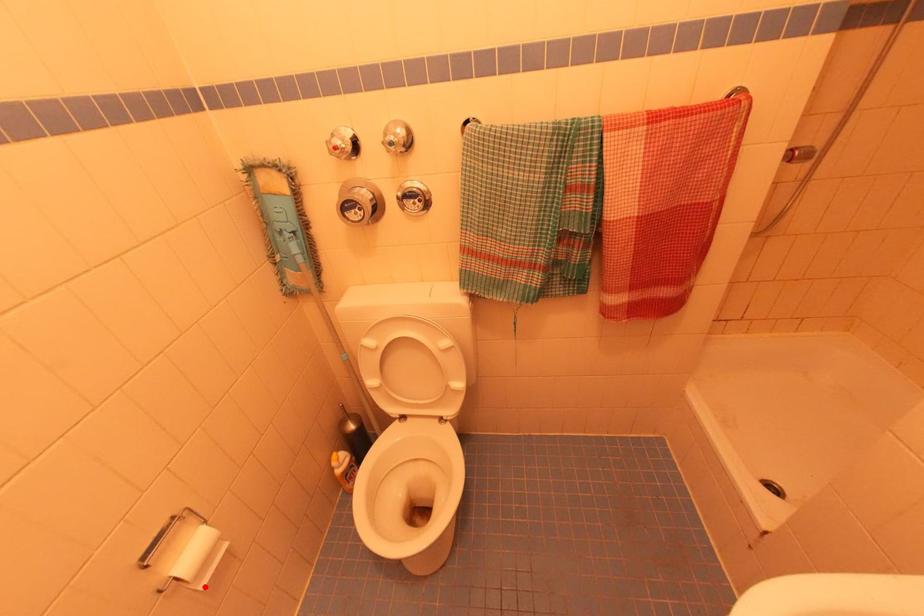
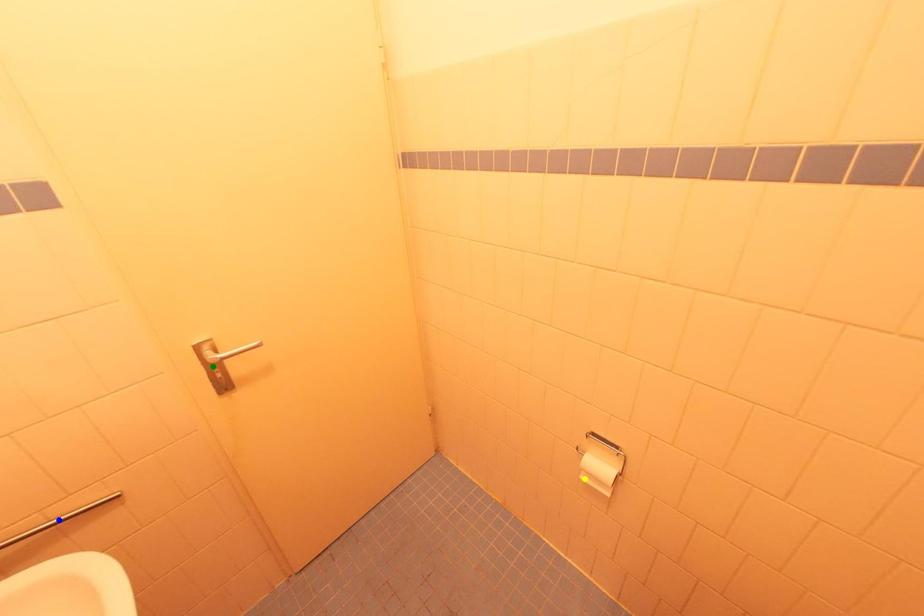
Question: I am providing you with two images of the same scene from different viewpoints. A red point is marked on the first image. You are given multiple points on the second image. Can you choose the point in image 2 that corresponds to the point in image 1?

Choices:
 (A) green point
 (B) yellow point
 (C) blue point

Answer: (B)